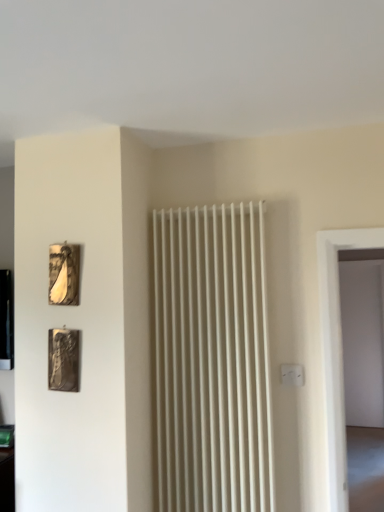
Question: In the image, is metallic gold picture frame at upper left, arranged as the 2th picture frame when ordered from the bottom, positioned in front of or behind metallic silver picture frame at lower left, the second picture frame viewed from the top?

Choices:
 (A) behind
 (B) front

Answer: (A)

Question: Considering the positions of metallic gold picture frame at upper left, placed as the 1th picture frame when sorted from top to bottom, and metallic silver picture frame at lower left, the second picture frame viewed from the top, in the image, is metallic gold picture frame at upper left, placed as the 1th picture frame when sorted from top to bottom, bigger or smaller than metallic silver picture frame at lower left, the second picture frame viewed from the top,?

Choices:
 (A) big
 (B) small

Answer: (B)

Question: Which object is positioned closest to the metallic silver picture frame at lower left, the second picture frame viewed from the top?

Choices:
 (A) metallic gold picture frame at upper left, arranged as the 2th picture frame when ordered from the bottom
 (B) white plastic electric outlet at center-right

Answer: (A)

Question: Which object is the closest to the metallic silver picture frame at lower left, the second picture frame viewed from the top?

Choices:
 (A) white plastic electric outlet at center-right
 (B) metallic gold picture frame at upper left, arranged as the 2th picture frame when ordered from the bottom

Answer: (B)